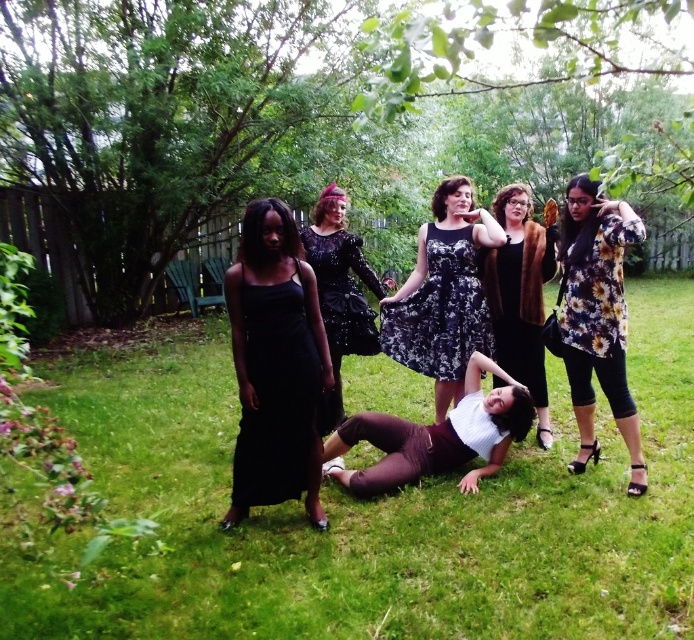
Is point (511, 228) farther from viewer compared to point (363, 328)?

No.

Is fuzzy brown fur coat at center to the right of black sequined dress at center from the viewer's perspective?

Correct, you'll find fuzzy brown fur coat at center to the right of black sequined dress at center.

Who is more forward, (541, 282) or (330, 346)?

Positioned in front is point (330, 346).

What are the coordinates of `fuzzy brown fur coat at center` in the screenshot? It's located at (518, 296).

Can you confirm if black floral dress at center is shorter than fuzzy brown fur coat at center?

Yes.

Is black floral dress at center bigger than fuzzy brown fur coat at center?

Incorrect, black floral dress at center is not larger than fuzzy brown fur coat at center.

What do you see at coordinates (440, 310) in the screenshot?
I see `black floral dress at center` at bounding box center [440, 310].

Find the location of a particular element. black floral dress at center is located at coordinates (440, 310).

Who is more forward, (x=330, y=600) or (x=339, y=282)?

Point (x=330, y=600) is in front.

Is point (271, 536) in front of point (330, 257)?

Yes, point (271, 536) is in front of point (330, 257).

Identify the location of green grass at center. (371, 516).